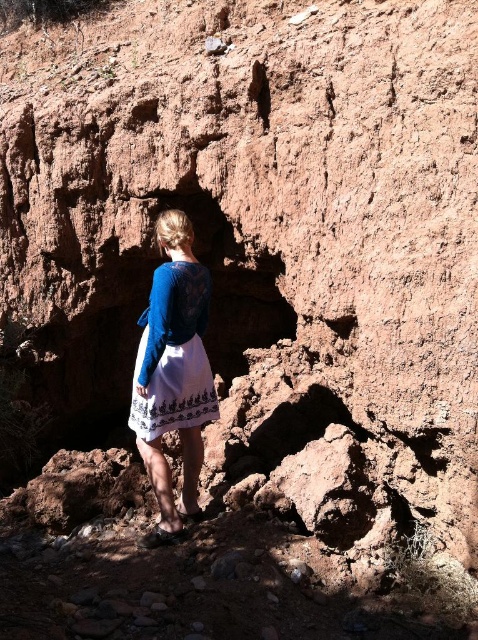
Question: Which object appears farthest from the camera in this image?

Choices:
 (A) white embroidered dress at center
 (B) blue lace dress at center

Answer: (A)

Question: Is blue lace dress at center below white embroidered dress at center?

Choices:
 (A) yes
 (B) no

Answer: (A)

Question: Does blue lace dress at center have a lesser width compared to white embroidered dress at center?

Choices:
 (A) no
 (B) yes

Answer: (B)

Question: Does blue lace dress at center appear under white embroidered dress at center?

Choices:
 (A) yes
 (B) no

Answer: (A)

Question: Which of the following is the farthest from the observer?

Choices:
 (A) white embroidered dress at center
 (B) blue lace dress at center

Answer: (A)